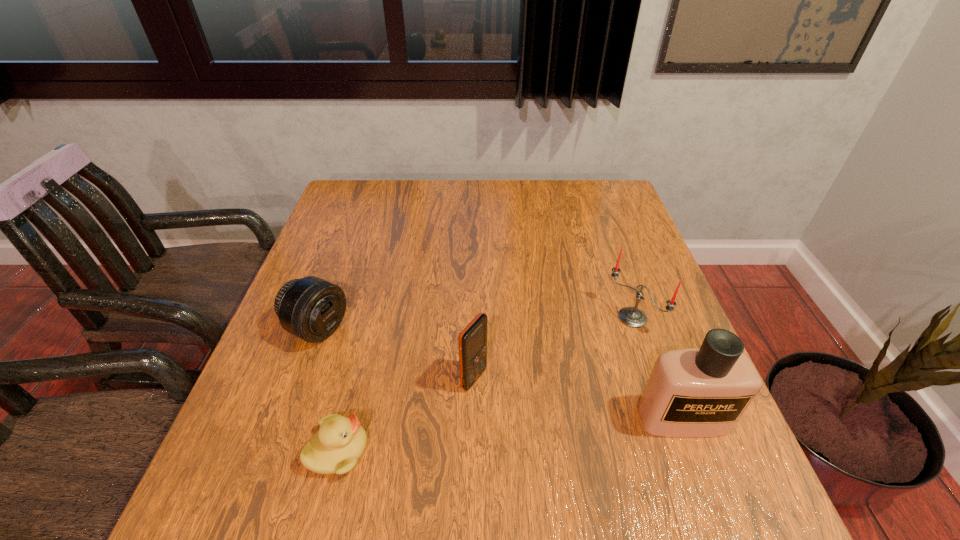
What are the coordinates of `free space between the candle and the third object from right to left` in the screenshot? It's located at (553, 348).

Locate an element on the screen. free space between the telephoto lens and the duckling is located at coordinates pyautogui.click(x=327, y=390).

This screenshot has height=540, width=960. Find the location of `free space between the cellular telephone and the shortest object`. free space between the cellular telephone and the shortest object is located at coordinates (406, 415).

What are the coordinates of `vacant point located between the tallest object and the telephoto lens` in the screenshot? It's located at (500, 374).

Identify the location of vacant point located between the candle and the duckling. (486, 384).

Identify the location of vacant space that's between the shortest object and the candle. (486, 384).

Identify the location of vacant area that lies between the second shortest object and the perfume. This screenshot has height=540, width=960. (500, 374).

The image size is (960, 540). I want to click on object that is the closest to the shortest object, so pos(310,308).

Locate which object ranks fourth in proximity to the shortest object. Please provide its 2D coordinates. Your answer should be formatted as a tuple, i.e. [(x, y)], where the tuple contains the x and y coordinates of a point satisfying the conditions above.

[(633, 317)]